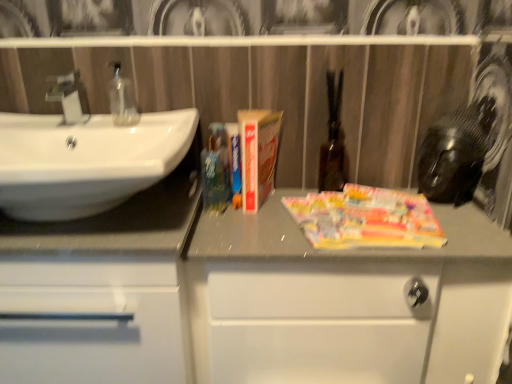
Question: Is transparent glass soap at left to the right of matte silver faucet at left from the viewer's perspective?

Choices:
 (A) yes
 (B) no

Answer: (A)

Question: Could you tell me if transparent glass soap at left is facing matte silver faucet at left?

Choices:
 (A) yes
 (B) no

Answer: (B)

Question: Is transparent glass soap at left positioned in front of matte silver faucet at left?

Choices:
 (A) no
 (B) yes

Answer: (A)

Question: Can you confirm if transparent glass soap at left is shorter than matte silver faucet at left?

Choices:
 (A) no
 (B) yes

Answer: (A)

Question: Is transparent glass soap at left to the left of matte silver faucet at left from the viewer's perspective?

Choices:
 (A) yes
 (B) no

Answer: (B)

Question: Can you confirm if transparent glass soap at left is taller than matte silver faucet at left?

Choices:
 (A) no
 (B) yes

Answer: (B)

Question: From the image's perspective, is white matte cabinet at center, the 2th bathroom cabinet in the left-to-right sequence, over white glossy sink at left?

Choices:
 (A) yes
 (B) no

Answer: (B)

Question: Is white matte cabinet at center, the first bathroom cabinet positioned from the right, touching white glossy sink at left?

Choices:
 (A) no
 (B) yes

Answer: (A)

Question: Considering the relative sizes of white matte cabinet at center, the first bathroom cabinet positioned from the right, and white glossy sink at left in the image provided, is white matte cabinet at center, the first bathroom cabinet positioned from the right, shorter than white glossy sink at left?

Choices:
 (A) yes
 (B) no

Answer: (B)

Question: Is white matte cabinet at center, the first bathroom cabinet positioned from the right, further to the viewer compared to white glossy sink at left?

Choices:
 (A) no
 (B) yes

Answer: (B)

Question: Can we say white matte cabinet at center, the 2th bathroom cabinet in the left-to-right sequence, lies outside white glossy sink at left?

Choices:
 (A) no
 (B) yes

Answer: (B)

Question: Can you confirm if white matte cabinet at center, the 2th bathroom cabinet in the left-to-right sequence, is wider than white glossy sink at left?

Choices:
 (A) no
 (B) yes

Answer: (A)

Question: Can you confirm if white glossy sink at left is bigger than white matte cabinet at center, the first bathroom cabinet positioned from the right?

Choices:
 (A) no
 (B) yes

Answer: (A)